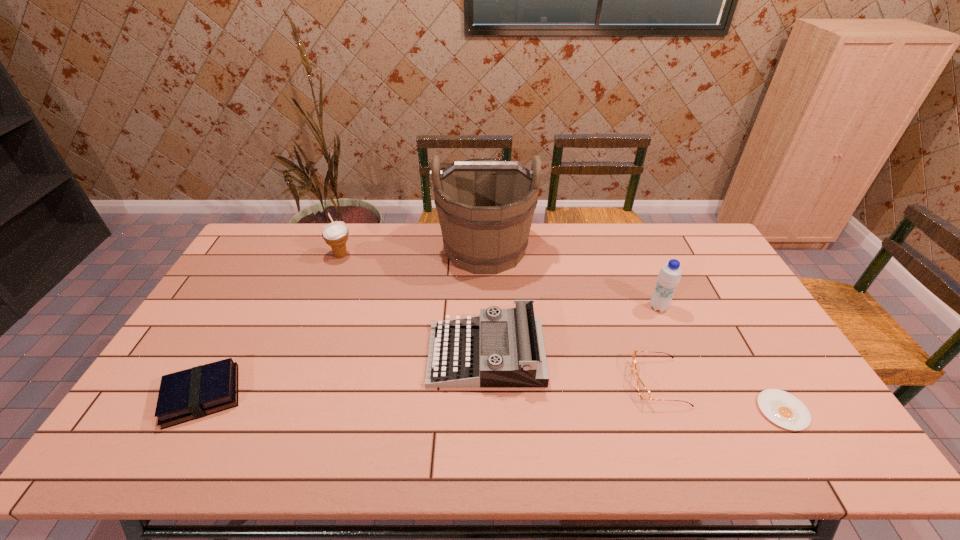
Where is `free space located 0.260m on the left of the water bottle`? Image resolution: width=960 pixels, height=540 pixels. free space located 0.260m on the left of the water bottle is located at coordinates (565, 307).

The width and height of the screenshot is (960, 540). Identify the location of vacant space located 0.350m on the right of the icecream. (451, 255).

The height and width of the screenshot is (540, 960). What are the coordinates of `vacant area situated on the typing side of the fourth shortest object` in the screenshot? It's located at (300, 355).

I want to click on free space located on the typing side of the fourth shortest object, so click(x=297, y=355).

Locate an element on the screen. The width and height of the screenshot is (960, 540). blank area located on the typing side of the fourth shortest object is located at coordinates [x=325, y=355].

Where is `free spot located 0.340m on the front-facing side of the spectacles`? This screenshot has width=960, height=540. free spot located 0.340m on the front-facing side of the spectacles is located at coordinates (505, 382).

Find the location of a particular element. free region located on the front-facing side of the spectacles is located at coordinates tap(542, 382).

This screenshot has width=960, height=540. In order to click on free space located on the front-facing side of the spectacles in this screenshot , I will do `click(516, 382)`.

Find the location of a particular element. vacant region located 0.070m on the right of the leftmost object is located at coordinates (271, 396).

The width and height of the screenshot is (960, 540). I want to click on free location located 0.240m on the back of the egg yolk, so click(732, 323).